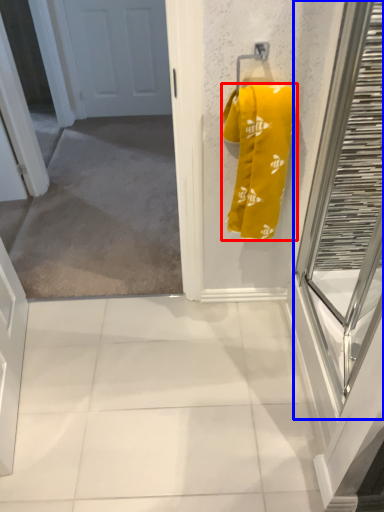
Question: Which object is closer to the camera taking this photo, towel (highlighted by a red box) or glass door (highlighted by a blue box)?

Choices:
 (A) towel
 (B) glass door

Answer: (B)